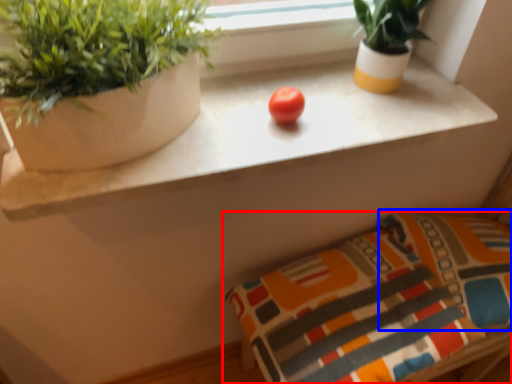
Question: Which object is closer to the camera taking this photo, pillow (highlighted by a red box) or pillow (highlighted by a blue box)?

Choices:
 (A) pillow
 (B) pillow

Answer: (A)